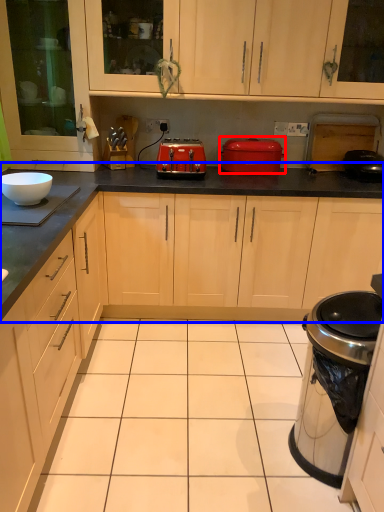
Question: Which object is closer to the camera taking this photo, kitchen appliance (highlighted by a red box) or countertop (highlighted by a blue box)?

Choices:
 (A) kitchen appliance
 (B) countertop

Answer: (B)